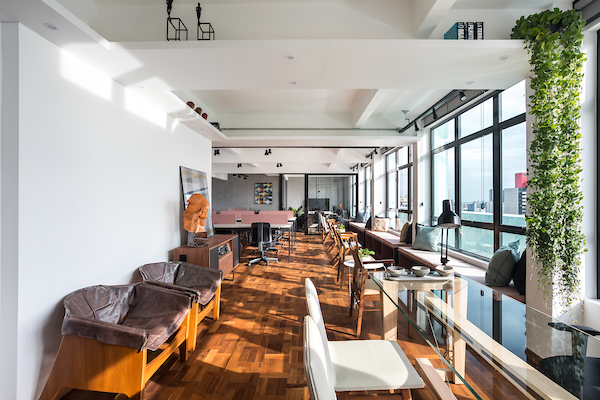
Find the location of a particular element. pillows is located at coordinates (360, 217), (370, 224), (382, 223), (404, 227), (409, 233), (425, 234), (499, 255), (522, 271).